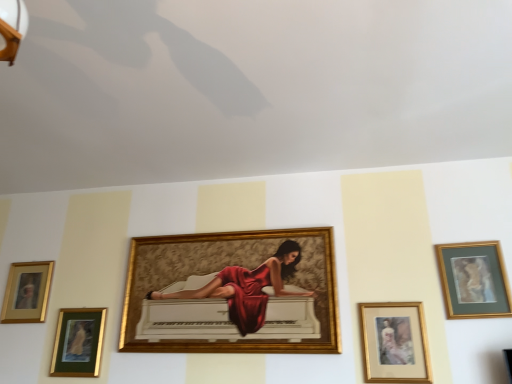
Question: Are gold-framed artwork at upper right, which appears as the fifth picture frame when viewed from the left, and gold/glossy picture frame at lower left, the 5th picture frame viewed from the right, beside each other?

Choices:
 (A) yes
 (B) no

Answer: (B)

Question: Is gold-framed artwork at upper right, placed as the first picture frame when sorted from right to left, at the left side of gold/glossy picture frame at lower left, the 5th picture frame viewed from the right?

Choices:
 (A) yes
 (B) no

Answer: (B)

Question: Does gold-framed artwork at upper right, placed as the first picture frame when sorted from right to left, have a greater width compared to gold/glossy picture frame at lower left, the 5th picture frame viewed from the right?

Choices:
 (A) yes
 (B) no

Answer: (A)

Question: Is gold-framed artwork at upper right, which appears as the fifth picture frame when viewed from the left, turned away from gold/glossy picture frame at lower left, arranged as the 1th picture frame when viewed from the left?

Choices:
 (A) no
 (B) yes

Answer: (A)

Question: From a real-world perspective, is gold-framed artwork at upper right, placed as the first picture frame when sorted from right to left, positioned over gold/glossy picture frame at lower left, the 5th picture frame viewed from the right, based on gravity?

Choices:
 (A) no
 (B) yes

Answer: (B)

Question: Considering the positions of point (248, 248) and point (75, 314), is point (248, 248) closer or farther from the camera than point (75, 314)?

Choices:
 (A) closer
 (B) farther

Answer: (A)

Question: Is gold-framed painting at center, placed as the third picture frame when sorted from left to right, wider or thinner than gold/glass picture frame at lower left, the 4th picture frame positioned from the right?

Choices:
 (A) wide
 (B) thin

Answer: (A)

Question: Based on their sizes in the image, would you say gold-framed painting at center, which appears as the third picture frame when viewed from the right, is bigger or smaller than gold/glass picture frame at lower left, the 4th picture frame positioned from the right?

Choices:
 (A) big
 (B) small

Answer: (A)

Question: In the image, is gold-framed painting at center, placed as the third picture frame when sorted from left to right, positioned in front of or behind gold/glass picture frame at lower left, the 4th picture frame positioned from the right?

Choices:
 (A) behind
 (B) front

Answer: (B)

Question: From a real-world perspective, is gold-framed painting at center, which appears as the third picture frame when viewed from the right, physically located above or below gold/glossy picture frame at lower left, arranged as the 1th picture frame when viewed from the left?

Choices:
 (A) below
 (B) above

Answer: (A)

Question: In the image, is gold-framed painting at center, placed as the third picture frame when sorted from left to right, positioned in front of or behind gold/glossy picture frame at lower left, arranged as the 1th picture frame when viewed from the left?

Choices:
 (A) front
 (B) behind

Answer: (A)

Question: Based on their positions, is gold-framed painting at center, which appears as the third picture frame when viewed from the right, located to the left or right of gold/glossy picture frame at lower left, arranged as the 1th picture frame when viewed from the left?

Choices:
 (A) right
 (B) left

Answer: (A)

Question: Is gold-framed painting at center, which appears as the third picture frame when viewed from the right, inside the boundaries of gold/glossy picture frame at lower left, the 5th picture frame viewed from the right, or outside?

Choices:
 (A) outside
 (B) inside

Answer: (A)

Question: Based on their sizes in the image, would you say gold-framed portrait at lower right, marked as the fourth picture frame in a left-to-right arrangement, is bigger or smaller than gold-framed painting at center, placed as the third picture frame when sorted from left to right?

Choices:
 (A) small
 (B) big

Answer: (A)

Question: Considering the positions of point (380, 357) and point (318, 301), is point (380, 357) closer or farther from the camera than point (318, 301)?

Choices:
 (A) farther
 (B) closer

Answer: (B)